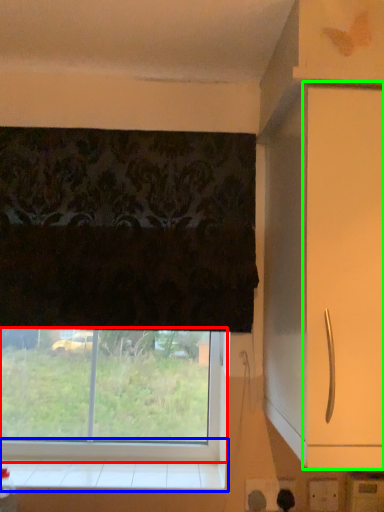
Question: Estimate the real-world distances between objects in this image. Which object is farther from window (highlighted by a red box), window sill (highlighted by a blue box) or screen door (highlighted by a green box)?

Choices:
 (A) window sill
 (B) screen door

Answer: (B)